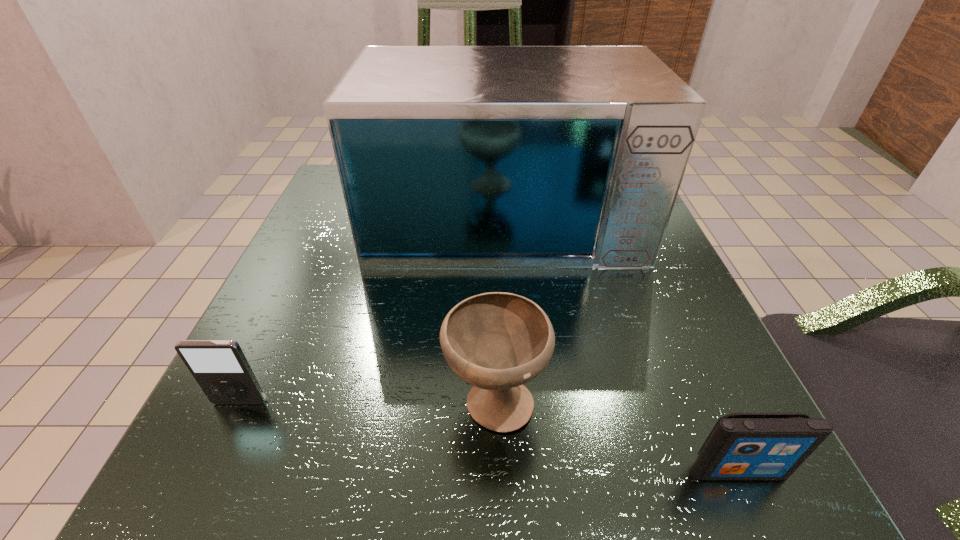
This screenshot has height=540, width=960. What are the coordinates of `unoccupied position between the left iPod and the third shortest object` in the screenshot? It's located at (368, 401).

At what (x,y) coordinates should I click in order to perform the action: click on empty space that is in between the leftmost object and the tallest object. Please return your answer as a coordinate pair (x, y). This screenshot has width=960, height=540. Looking at the image, I should click on (372, 306).

Where is `free spot between the leftmost object and the tallest object`? The height and width of the screenshot is (540, 960). free spot between the leftmost object and the tallest object is located at coordinates (372, 306).

In order to click on empty space between the leftmost object and the microwave oven in this screenshot , I will do `click(372, 306)`.

You are a GUI agent. You are given a task and a screenshot of the screen. Output one action in this format:
    pyautogui.click(x=<x>, y=<y>)
    Task: Click on the empty space that is in between the tallest object and the farther iPod
    
    Given the screenshot: What is the action you would take?
    pyautogui.click(x=372, y=306)

The width and height of the screenshot is (960, 540). Find the location of `object that ranks as the closest to the left iPod`. object that ranks as the closest to the left iPod is located at coordinates (496, 341).

Where is `object that is the closest to the farthest object`? This screenshot has height=540, width=960. object that is the closest to the farthest object is located at coordinates (496, 341).